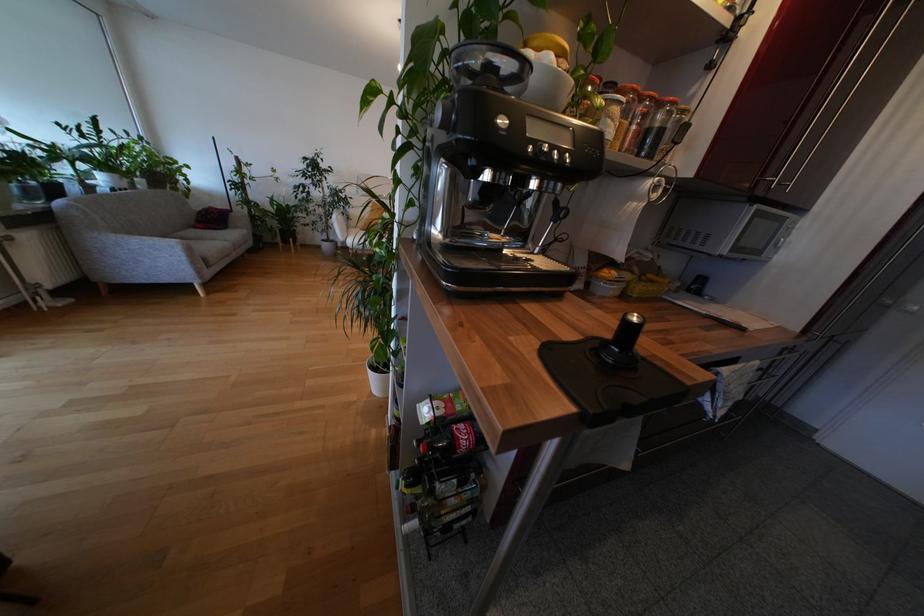
Where would you turn the coffee machine dial? Please return your answer as a coordinate pair (x, y).

(566, 160)